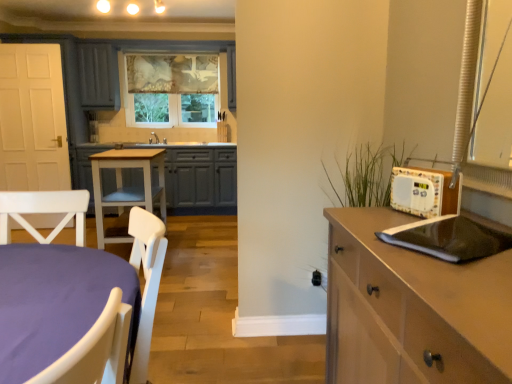
You are a GUI agent. You are given a task and a screenshot of the screen. Output one action in this format:
    pyautogui.click(x=<x>, y=<y>)
    Task: Click on the vacant space underneath black matte laptop at right (from a real-world perspective)
    The height and width of the screenshot is (384, 512).
    Given the screenshot: What is the action you would take?
    pyautogui.click(x=457, y=246)